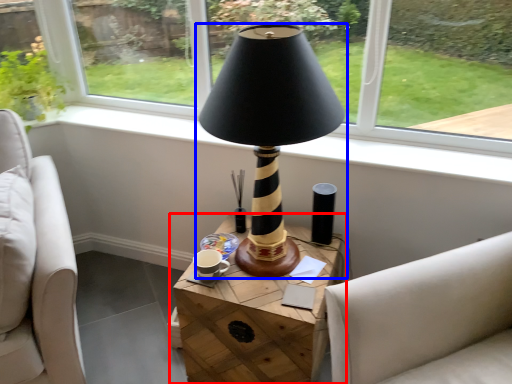
Question: Which object appears closest to the camera in this image, table (highlighted by a red box) or lamp (highlighted by a blue box)?

Choices:
 (A) table
 (B) lamp

Answer: (B)